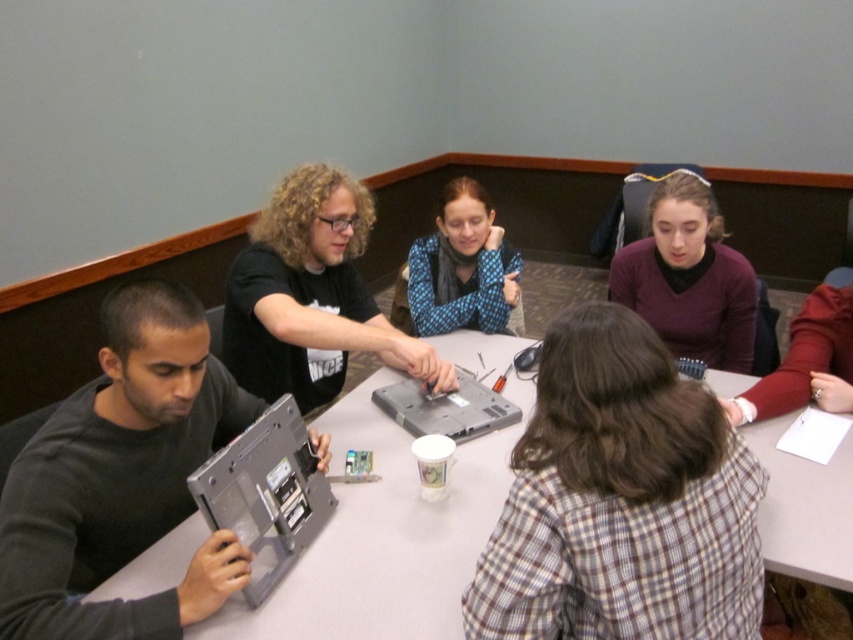
Question: Which object appears farthest from the camera in this image?

Choices:
 (A) brown plaid shirt at center
 (B) gray plastic table at center
 (C) gray plastic laptop at center

Answer: (C)

Question: Is matte black laptop at left thinner than gray plastic laptop at center?

Choices:
 (A) yes
 (B) no

Answer: (B)

Question: Which point is closer to the camera taking this photo?

Choices:
 (A) (448, 406)
 (B) (251, 381)

Answer: (A)

Question: Can you confirm if brown plaid shirt at center is positioned below gray metallic laptop at lower left?

Choices:
 (A) no
 (B) yes

Answer: (A)

Question: Does matte purple sweater at center appear under blue dotted sweater at center?

Choices:
 (A) no
 (B) yes

Answer: (B)

Question: Among these objects, which one is nearest to the camera?

Choices:
 (A) matte purple sweater at center
 (B) gray plastic table at center

Answer: (B)